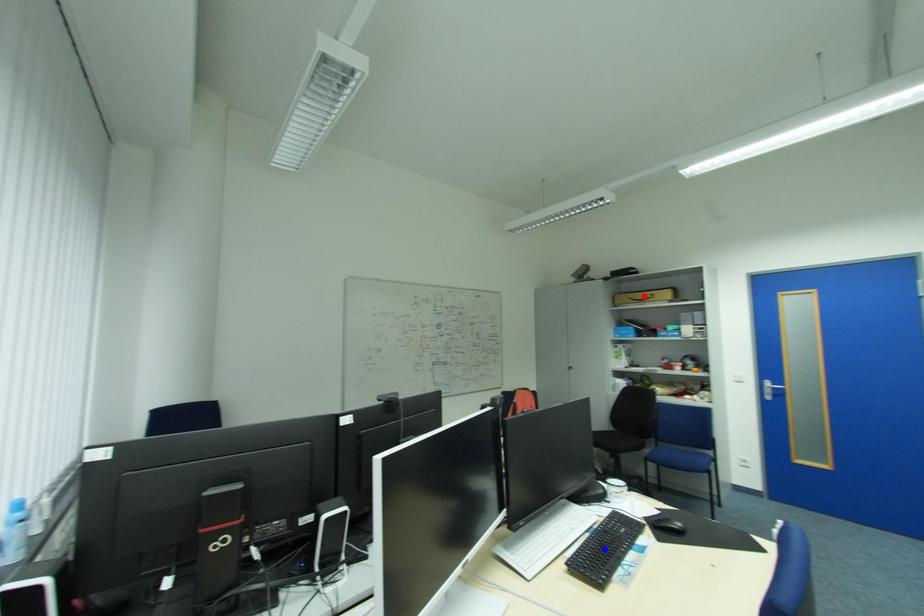
Question: Which of the two points in the image is closer to the camera?

Choices:
 (A) Blue point is closer.
 (B) Red point is closer.

Answer: (A)